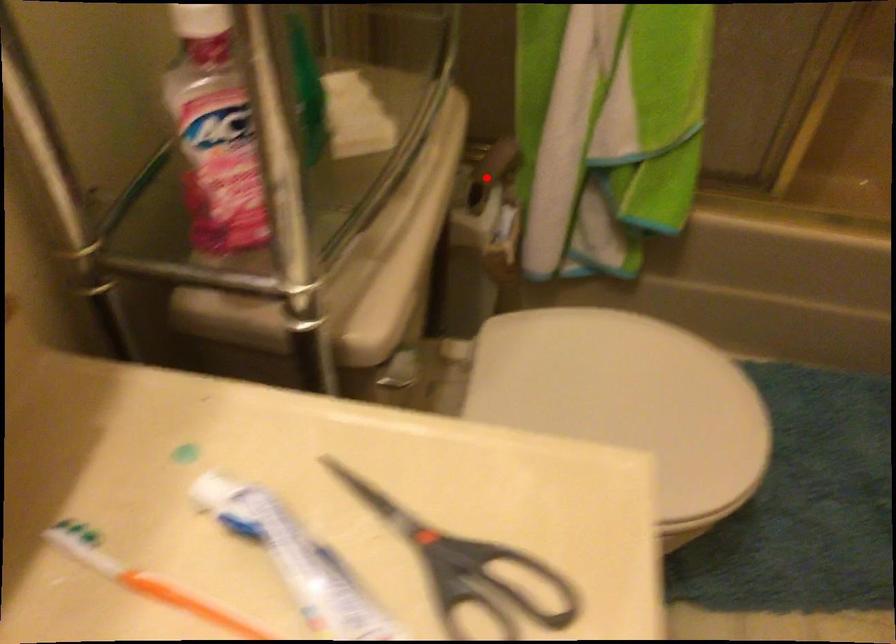
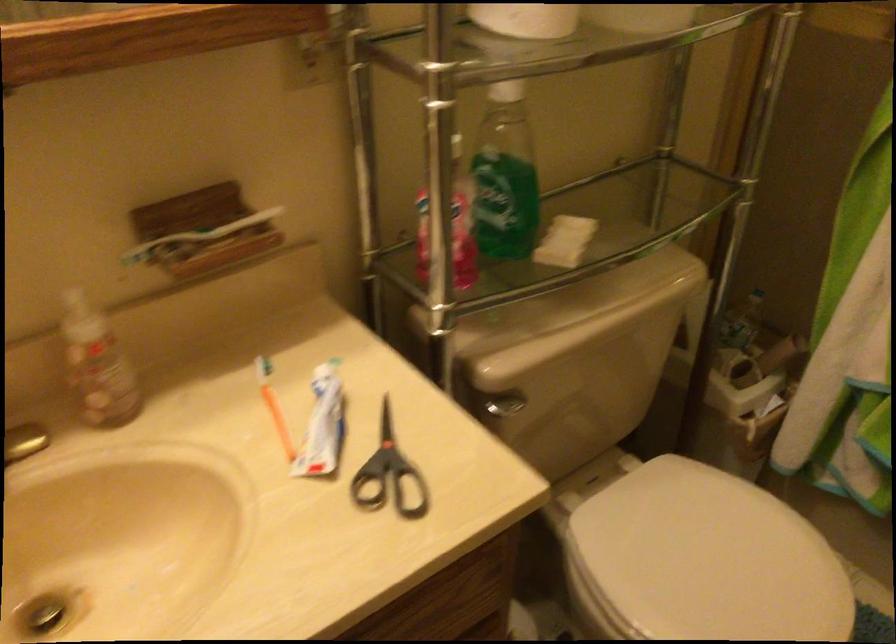
Where in the second image is the point corresponding to the highlighted location from the first image?

(764, 361)